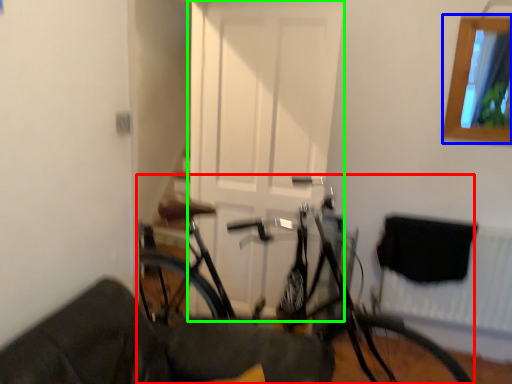
Question: Based on their relative distances, which object is farther from bicycle (highlighted by a red box)? Choose from window (highlighted by a blue box) and door (highlighted by a green box).

Choices:
 (A) window
 (B) door

Answer: (A)